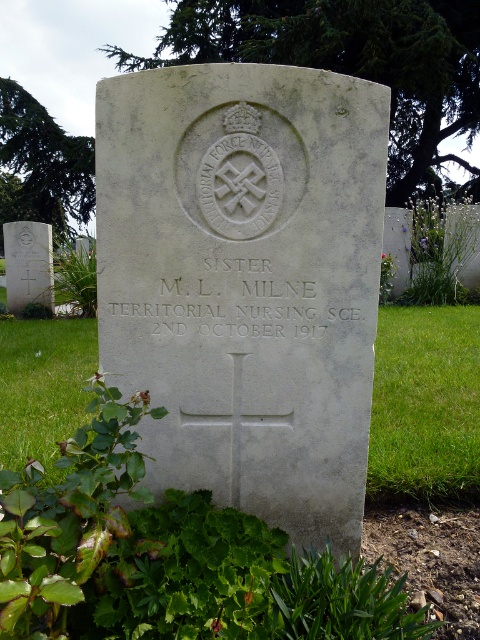
Question: Is green grass at lower center below green grass at lower right?

Choices:
 (A) yes
 (B) no

Answer: (B)

Question: Considering the real-world distances, which object is farthest from the green grass at lower right?

Choices:
 (A) gray stone cross at center
 (B) green grass at lower center

Answer: (A)

Question: Observing the image, what is the correct spatial positioning of gray stone cross at center in reference to green grass at lower right?

Choices:
 (A) below
 (B) above

Answer: (B)

Question: Among these objects, which one is nearest to the camera?

Choices:
 (A) green grass at lower right
 (B) gray stone cross at center
 (C) green grass at lower center

Answer: (B)

Question: Can you confirm if gray stone cross at center is positioned below green grass at lower center?

Choices:
 (A) yes
 (B) no

Answer: (B)

Question: Which object is closer to the camera taking this photo?

Choices:
 (A) gray stone cross at center
 (B) green grass at lower right

Answer: (A)